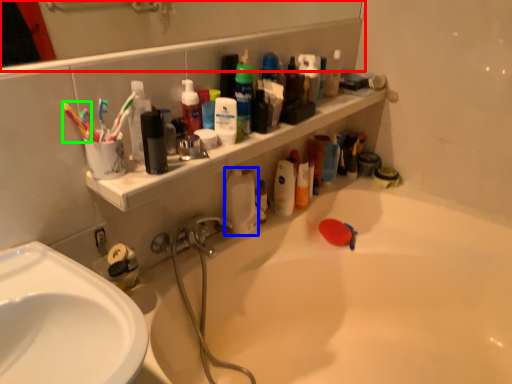
Question: Which object is positioned closest to mirror (highlighted by a red box)? Select from cleaning product (highlighted by a blue box) and toothbrush (highlighted by a green box).

Choices:
 (A) cleaning product
 (B) toothbrush

Answer: (A)